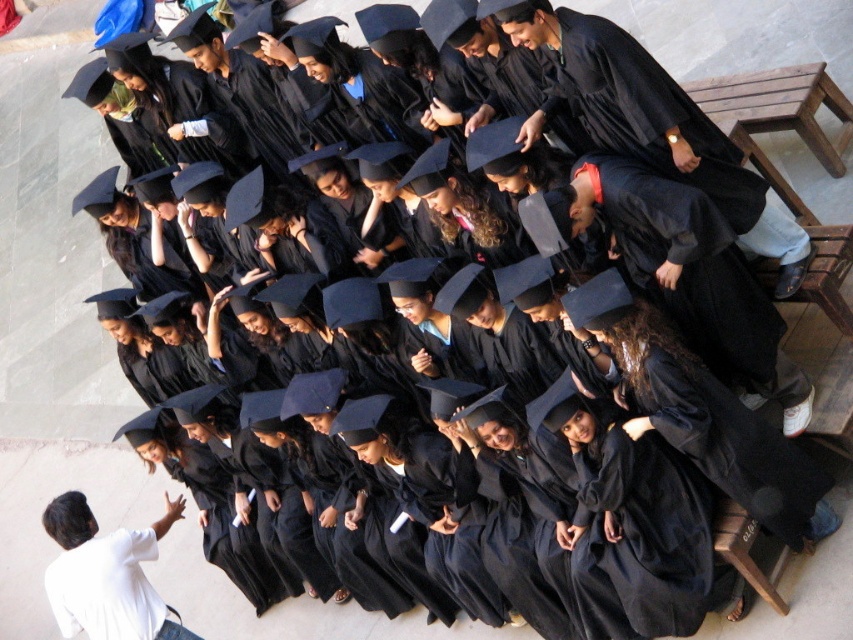
You are a photographer trying to capture a group photo of the graduates. You notice the matte black graduation gown at center and the white matte shirt at lower left. Which object should you focus on first if you want to ensure both are in frame without moving the camera?

You should focus on the matte black graduation gown at center first because it is larger in size compared to the white matte shirt at lower left, ensuring it fits within the frame before adjusting for the smaller object.

You are standing at the point labeled point (625, 70) in the image. You want to take a photo of the graduation ceremony scene. Will you be able to see the entire group of graduates in your camera frame if your camera has a 70mm lens? Explain your reasoning.

The point labeled point (625, 70) is 6.37 meters away from the viewer. Since the camera lens is 70mm, which has a moderate field of view, and the graduates are positioned in a tiered formation that slopes downward from left to right, it is likely that the entire group can be captured in the frame. However, precise visibility depends on the camera sensor size and zoom level, but based on the distance provided, the 70mm lens should accommodate the scene.

You are a photographer taking a group photo of the graduates. You need to ensure that the matte black robe at center and the white matte shirt at lower left are both clearly visible in the photo. Given their sizes, which object should you focus on to ensure both are in frame?

The matte black robe at center is larger in size compared to the white matte shirt at lower left. To ensure both are clearly visible, focus on the matte black robe at center since its larger size will be easier to capture, while the smaller white matte shirt at lower left can be positioned within the same frame without overcrowding.